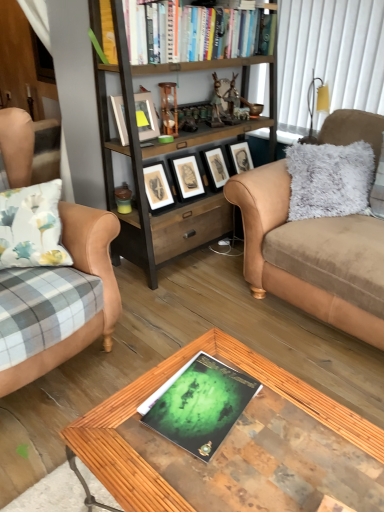
Question: From a real-world perspective, is woodenmaterial/texture bookcase at center physically below hardcover books at upper center?

Choices:
 (A) yes
 (B) no

Answer: (A)

Question: Is woodenmaterial/texture bookcase at center facing away from hardcover books at upper center?

Choices:
 (A) yes
 (B) no

Answer: (A)

Question: From the image's perspective, is woodenmaterial/texture bookcase at center under hardcover books at upper center?

Choices:
 (A) yes
 (B) no

Answer: (A)

Question: Is the surface of woodenmaterial/texture bookcase at center in direct contact with hardcover books at upper center?

Choices:
 (A) yes
 (B) no

Answer: (B)

Question: Is woodenmaterial/texture bookcase at center shorter than hardcover books at upper center?

Choices:
 (A) no
 (B) yes

Answer: (A)

Question: Considering the relative sizes of woodenmaterial/texture bookcase at center and hardcover books at upper center in the image provided, is woodenmaterial/texture bookcase at center smaller than hardcover books at upper center?

Choices:
 (A) no
 (B) yes

Answer: (A)

Question: Is woodenmaterial/texture bookcase at center closer to the viewer compared to matte black picture frame at center, placed as the second picture frame when sorted from left to right?

Choices:
 (A) yes
 (B) no

Answer: (A)

Question: Can you confirm if woodenmaterial/texture bookcase at center is wider than matte black picture frame at center, which ranks as the 1th picture frame in right-to-left order?

Choices:
 (A) no
 (B) yes

Answer: (B)

Question: Is woodenmaterial/texture bookcase at center aimed at matte black picture frame at center, which appears as the 2th picture frame when viewed from the front?

Choices:
 (A) no
 (B) yes

Answer: (B)

Question: From a real-world perspective, is woodenmaterial/texture bookcase at center on top of matte black picture frame at center, placed as the second picture frame when sorted from left to right?

Choices:
 (A) yes
 (B) no

Answer: (A)

Question: Can you confirm if woodenmaterial/texture bookcase at center is shorter than matte black picture frame at center, which appears as the 2th picture frame when viewed from the front?

Choices:
 (A) yes
 (B) no

Answer: (B)

Question: Is woodenmaterial/texture bookcase at center beside matte black picture frame at center, which ranks as the 1th picture frame in right-to-left order?

Choices:
 (A) no
 (B) yes

Answer: (A)

Question: Is wooden glass coffee table at center oriented away from matte black picture frame at center, which appears as the 2th picture frame when viewed from the front?

Choices:
 (A) yes
 (B) no

Answer: (B)